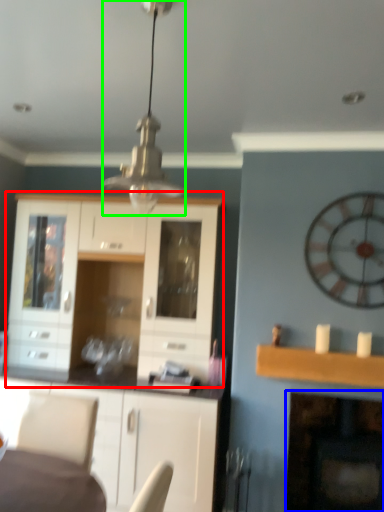
Question: Which object is the closest to the cabinetry (highlighted by a red box)? Choose among these: fireplace (highlighted by a blue box) or light fixture (highlighted by a green box).

Choices:
 (A) fireplace
 (B) light fixture

Answer: (B)